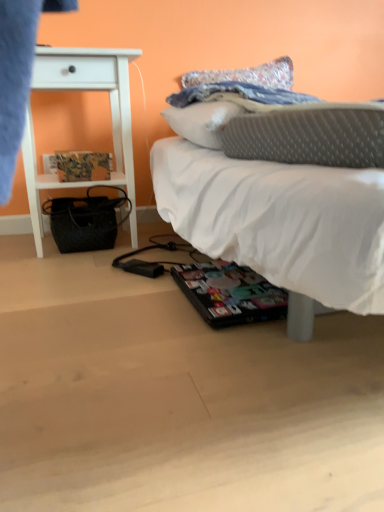
At what (x,y) coordinates should I click in order to perform the action: click on vacant area that is in front of white wood nightstand at left. Please return your answer as a coordinate pair (x, y). This screenshot has width=384, height=512. Looking at the image, I should click on (71, 275).